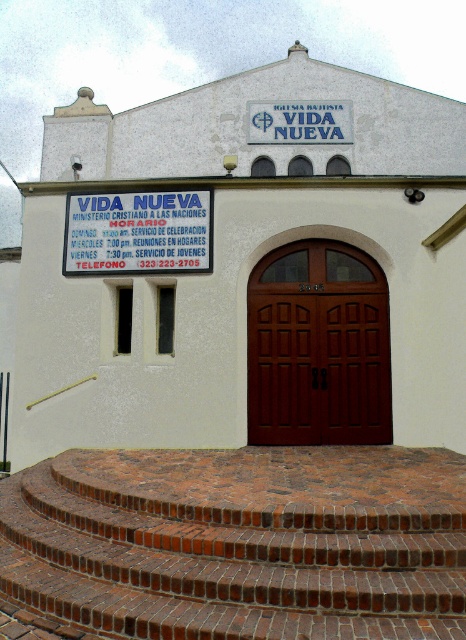
You are standing in front of the VIDA NUEVA building and want to take a photo of the white matte building at center. If your camera has a maximum focus range of 7 meters, will it be able to capture the building clearly?

The white matte building at center is 7.53 meters from the camera, which exceeds the maximum focus range of 7 meters. Therefore, the camera may not be able to capture the building clearly.

In the scene shown: You are standing at the entrance of the building labeled VIDA NUEVA. You need to locate the white matte building at center. Based on its coordinates, where exactly is it positioned?

The white matte building at center is positioned at coordinates point (242, 272).